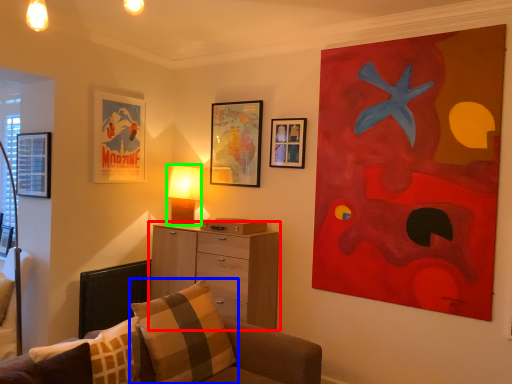
Question: Which object is the closest to the chest of drawers (highlighted by a red box)? Choose among these: pillow (highlighted by a blue box) or table lamp (highlighted by a green box).

Choices:
 (A) pillow
 (B) table lamp

Answer: (B)